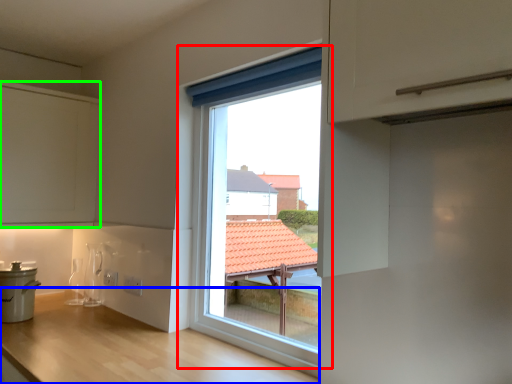
Question: Which is farther away from window (highlighted by a red box)? counter (highlighted by a blue box) or cabinetry (highlighted by a green box)?

Choices:
 (A) counter
 (B) cabinetry

Answer: (B)